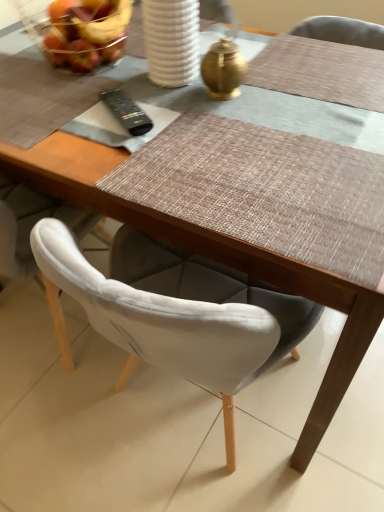
Find the location of `free space in front of black plastic remote at center`. free space in front of black plastic remote at center is located at coordinates (128, 160).